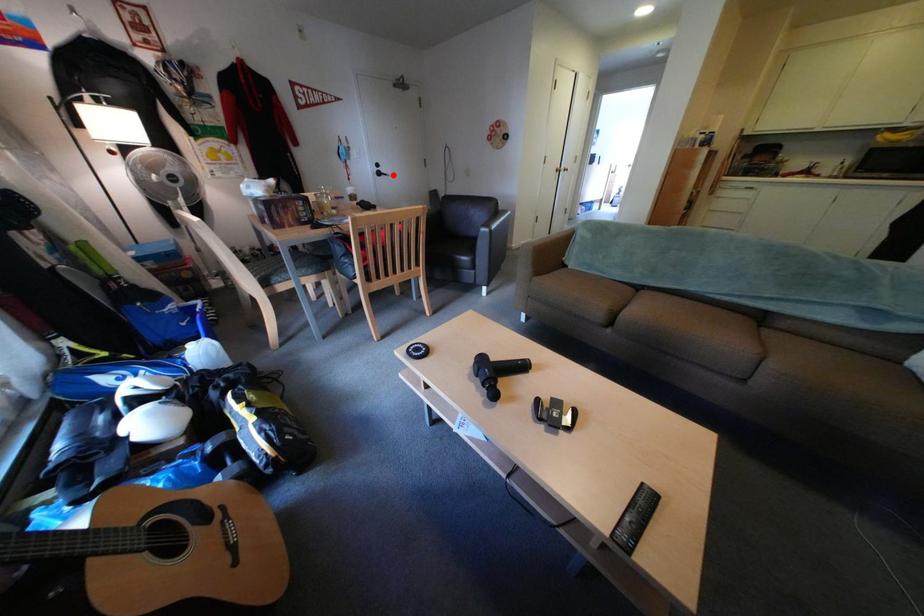
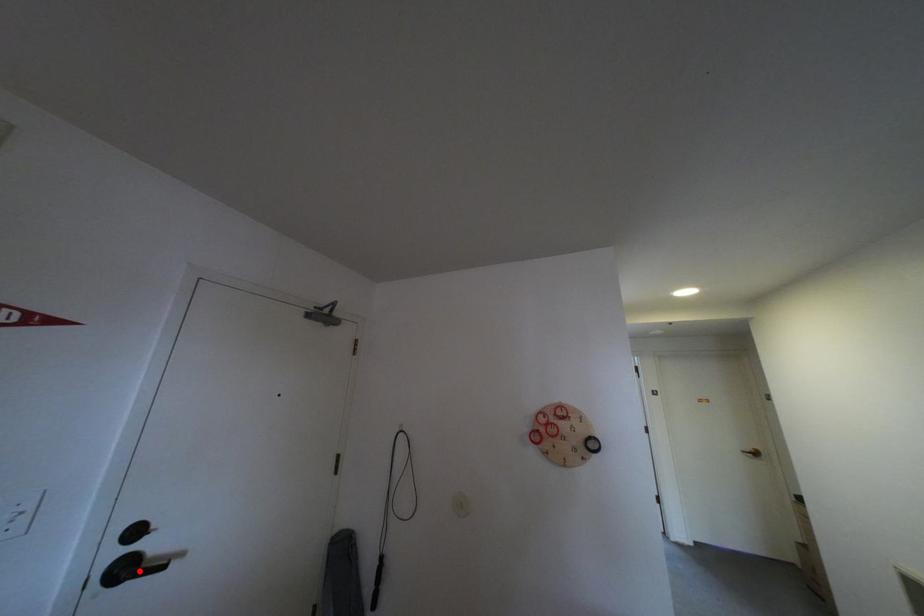
I am providing you with two images of the same scene from different viewpoints. A red point is marked on the first image and another point is marked on the second image. Does the point marked in image1 correspond to the same location as the one in image2?

Yes